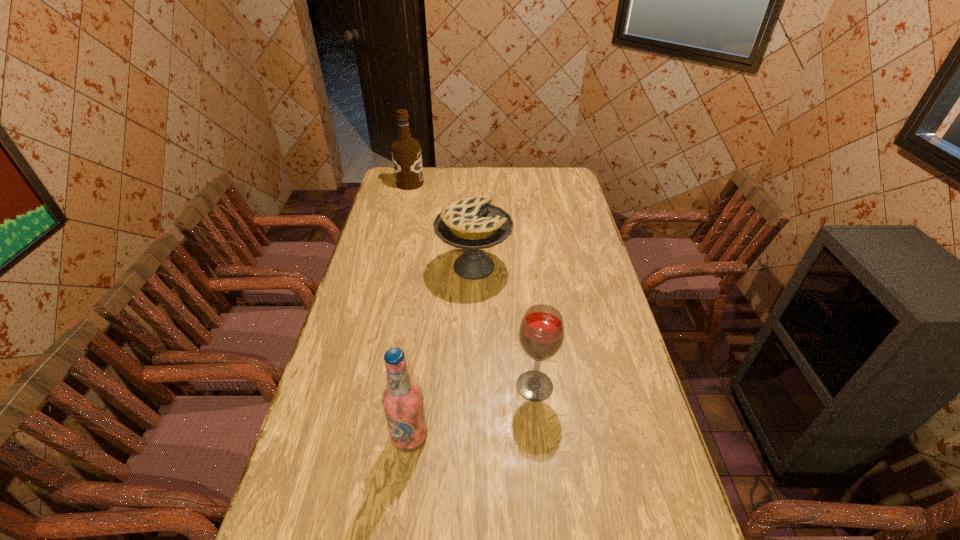
This screenshot has width=960, height=540. What are the coordinates of `the farthest object` in the screenshot? It's located at [x=406, y=153].

This screenshot has width=960, height=540. I want to click on the farthest alcohol, so click(406, 153).

Find the location of `the nearest object`. the nearest object is located at coordinates (x=402, y=399).

In order to click on the nearest alcohol in this screenshot , I will do `click(402, 399)`.

I want to click on the rightmost alcohol, so click(541, 333).

You are a GUI agent. You are given a task and a screenshot of the screen. Output one action in this format:
    pyautogui.click(x=<x>, y=<y>)
    Task: Click on the third farthest object
    The image size is (960, 540).
    Given the screenshot: What is the action you would take?
    pyautogui.click(x=541, y=333)

In order to click on pie in this screenshot , I will do `click(473, 223)`.

At what (x,y) coordinates should I click in order to perform the action: click on vacant point located 0.230m on the label of the leftmost alcohol. Please return your answer as a coordinate pair (x, y). This screenshot has height=540, width=960. Looking at the image, I should click on (470, 183).

Locate an element on the screen. The height and width of the screenshot is (540, 960). vacant space located on the back of the nearest object is located at coordinates (425, 314).

Locate an element on the screen. This screenshot has height=540, width=960. vacant space located 0.130m on the right of the shortest alcohol is located at coordinates (599, 386).